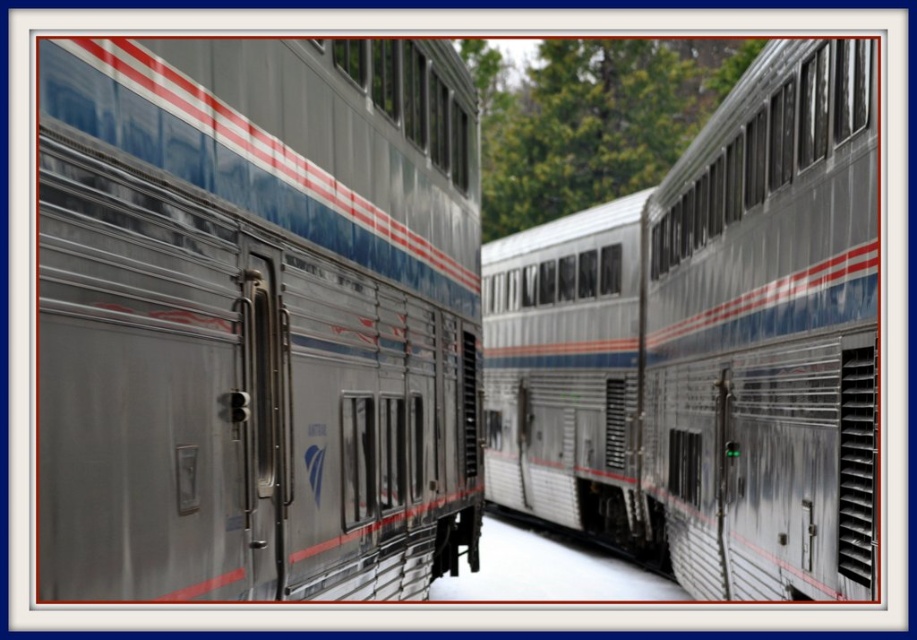
You are a passenger trying to board the train. You see two train cars, the polished silver train at center and the silver metallic train at center. Which one has a door that is slightly open?

The silver metallic train at center has a door that is slightly ajar.

You are a passenger waiting to board the train and see two trains at the station. You need to board the train on the left. Which one should you approach between the polished silver train at center and the silver metallic train at center?

The polished silver train at center is positioned on the left side of the silver metallic train at center, so you should approach the polished silver train at center to board the train on the left.